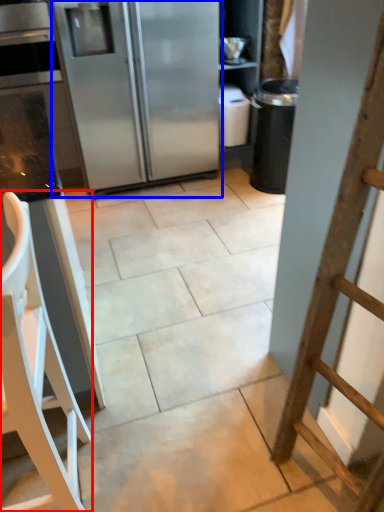
Question: Which object appears closest to the camera in this image, furniture (highlighted by a red box) or refrigerator (highlighted by a blue box)?

Choices:
 (A) furniture
 (B) refrigerator

Answer: (A)